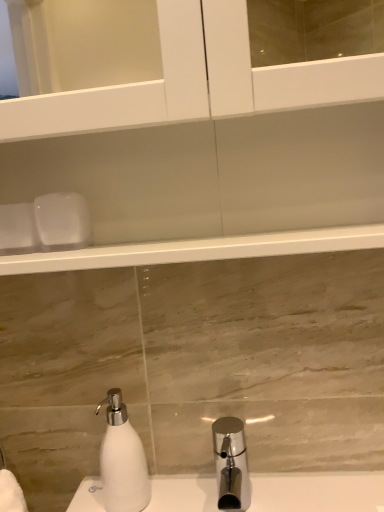
Question: Considering the positions of chrome metallic tap at lower center and white matte soap dispenser at lower left in the image, is chrome metallic tap at lower center bigger or smaller than white matte soap dispenser at lower left?

Choices:
 (A) big
 (B) small

Answer: (A)

Question: Looking at their shapes, would you say chrome metallic tap at lower center is wider or thinner than white matte soap dispenser at lower left?

Choices:
 (A) wide
 (B) thin

Answer: (A)

Question: From a real-world perspective, relative to white matte soap dispenser at lower left, is chrome metallic tap at lower center vertically above or below?

Choices:
 (A) below
 (B) above

Answer: (A)

Question: Is white matte soap dispenser at lower left situated inside chrome metallic tap at lower center or outside?

Choices:
 (A) inside
 (B) outside

Answer: (B)

Question: Considering their positions, is white matte soap dispenser at lower left located in front of or behind chrome metallic tap at lower center?

Choices:
 (A) front
 (B) behind

Answer: (B)

Question: Visually, is white matte soap dispenser at lower left positioned to the left or to the right of chrome metallic tap at lower center?

Choices:
 (A) left
 (B) right

Answer: (A)

Question: From the image's perspective, is white matte soap dispenser at lower left located above or below chrome metallic tap at lower center?

Choices:
 (A) above
 (B) below

Answer: (A)